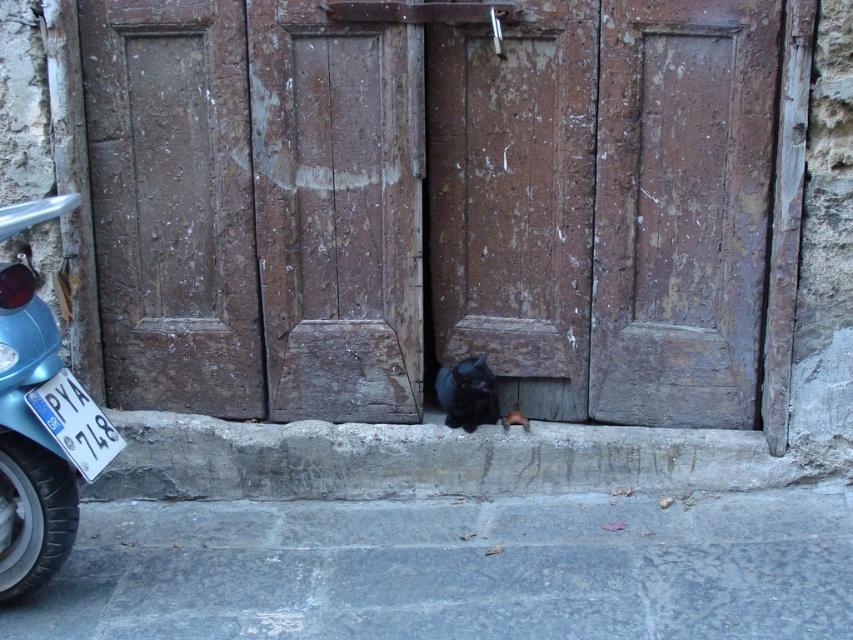
Question: Which point is farther from the camera taking this photo?

Choices:
 (A) (315, 108)
 (B) (35, 330)
 (C) (558, 433)
 (D) (457, 381)

Answer: (C)

Question: Does gray concrete curb at lower center have a lesser width compared to black fur cat at center?

Choices:
 (A) yes
 (B) no

Answer: (B)

Question: Can you confirm if rusty wood door at center is positioned to the left of blue glossy motorcycle at left?

Choices:
 (A) no
 (B) yes

Answer: (A)

Question: Is blue glossy motorcycle at left wider than black fur cat at center?

Choices:
 (A) yes
 (B) no

Answer: (A)

Question: Which of these objects is positioned farthest from the rusty wood door at center?

Choices:
 (A) black fur cat at center
 (B) blue glossy motorcycle at left

Answer: (B)

Question: Which point is farther to the camera?

Choices:
 (A) rusty wood door at center
 (B) black fur cat at center
 (C) gray concrete curb at lower center
 (D) blue glossy motorcycle at left

Answer: (B)